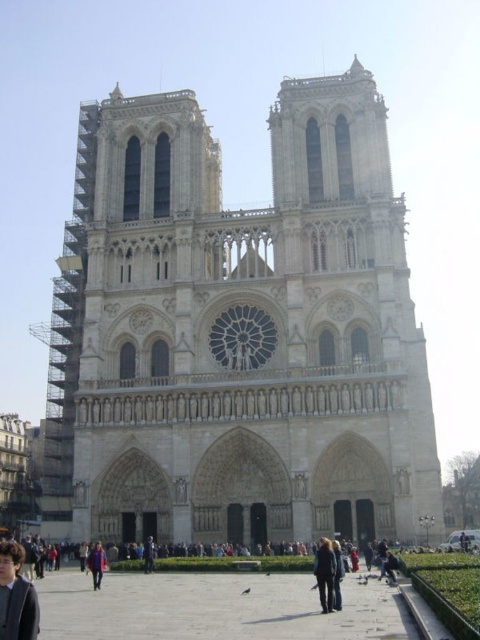
Question: Which object is positioned farthest from the dark brown hair at lower left?

Choices:
 (A) white stone tower at center
 (B) blue denim jacket at lower center

Answer: (A)

Question: Estimate the real-world distances between objects in this image. Which object is farther from the dark brown hair at lower left?

Choices:
 (A) dark gray fabric coat at center
 (B) white stone tower at center

Answer: (B)

Question: Estimate the real-world distances between objects in this image. Which object is closer to the white stone tower at center?

Choices:
 (A) dark gray fabric coat at center
 (B) dark brown hair at lower left
 (C) blue denim jacket at lower center

Answer: (C)

Question: Is the position of dark brown hair at lower left more distant than that of dark gray fabric coat at center?

Choices:
 (A) no
 (B) yes

Answer: (A)

Question: Is the position of white stone tower at center less distant than that of dark brown hair at lower left?

Choices:
 (A) yes
 (B) no

Answer: (B)

Question: Is dark brown hair at lower left to the right of blue denim jacket at lower center from the viewer's perspective?

Choices:
 (A) yes
 (B) no

Answer: (A)